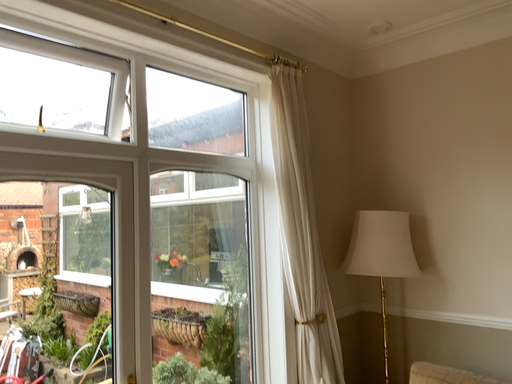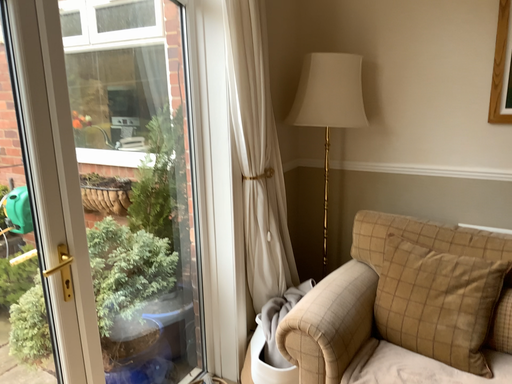
Question: How did the camera likely rotate when shooting the video?

Choices:
 (A) rotated right
 (B) rotated left

Answer: (A)